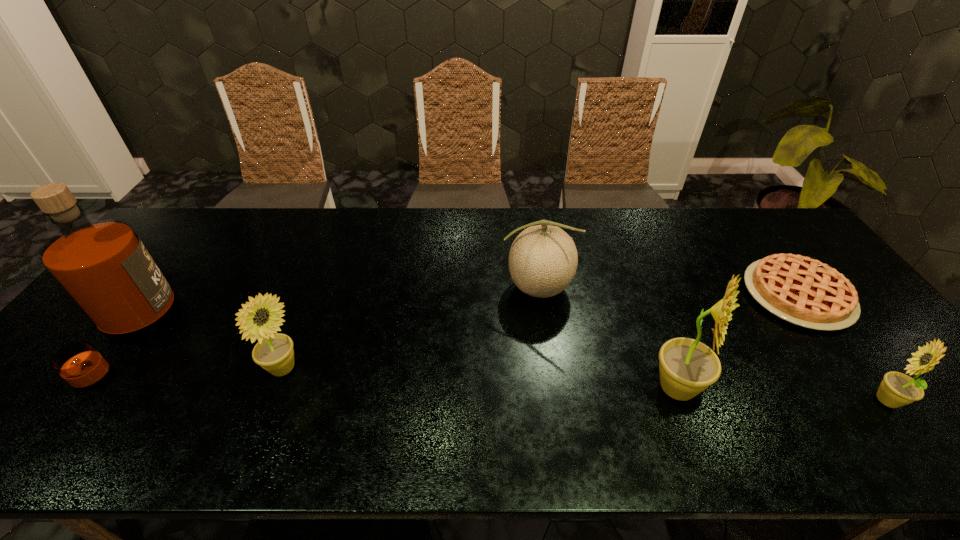
Find the location of a particular element. Image resolution: width=960 pixels, height=540 pixels. the fifth object from right to left is located at coordinates (274, 353).

This screenshot has width=960, height=540. In order to click on the leftmost sunflower in this screenshot , I will do `click(274, 353)`.

Find the location of `the tallest sunflower`. the tallest sunflower is located at coordinates (687, 367).

Find the location of a particular element. the third object from right to left is located at coordinates (687, 367).

Image resolution: width=960 pixels, height=540 pixels. What are the coordinates of `the rightmost sunflower` in the screenshot? It's located at [897, 389].

The height and width of the screenshot is (540, 960). I want to click on the shortest sunflower, so click(x=897, y=389).

Find the location of `the leftmost object`. the leftmost object is located at coordinates (103, 266).

Find the location of `the third object from left to right`. the third object from left to right is located at coordinates (543, 259).

Locate an element on the screen. This screenshot has height=540, width=960. pie is located at coordinates (803, 291).

I want to click on free space located on the face of the second object from left to right, so click(393, 369).